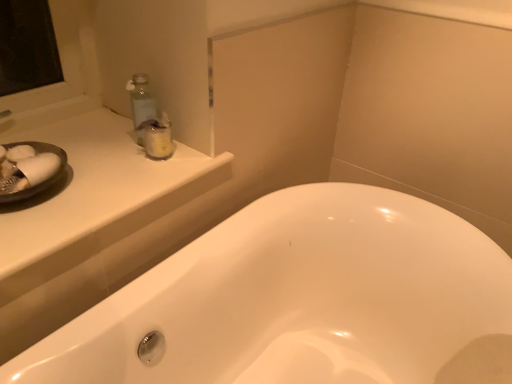
The image size is (512, 384). Describe the element at coordinates (157, 137) in the screenshot. I see `clear plastic jar at upper left` at that location.

This screenshot has width=512, height=384. What do you see at coordinates (303, 301) in the screenshot?
I see `white glossy bathtub at center` at bounding box center [303, 301].

In order to click on white glossy counter top at upper left in this screenshot , I will do pyautogui.click(x=98, y=193).

How different are the orientations of clear plastic jar at upper left and white glossy counter top at upper left in degrees?

6.77 degrees.

Which object is thinner, clear plastic jar at upper left or white glossy counter top at upper left?

Thinner between the two is clear plastic jar at upper left.

From the image's perspective, between clear plastic jar at upper left and white glossy counter top at upper left, which one is located above?

clear plastic jar at upper left, from the image's perspective.

Can you confirm if clear plastic jar at upper left is taller than white glossy bathtub at center?

Incorrect, the height of clear plastic jar at upper left is not larger of that of white glossy bathtub at center.

Is clear plastic jar at upper left smaller than white glossy bathtub at center?

Correct, clear plastic jar at upper left occupies less space than white glossy bathtub at center.

Consider the image. Is clear plastic jar at upper left next to white glossy bathtub at center and touching it?

They are not placed beside each other.

Does white glossy counter top at upper left lie behind white glossy bathtub at center?

Yes, the depth of white glossy counter top at upper left is greater than that of white glossy bathtub at center.

The width and height of the screenshot is (512, 384). I want to click on bathtub beneath the white glossy counter top at upper left (from a real-world perspective), so click(x=303, y=301).

Is white glossy counter top at upper left bigger or smaller than white glossy bathtub at center?

In the image, white glossy counter top at upper left appears to be smaller than white glossy bathtub at center.

Is white glossy counter top at upper left not within clear plastic jar at upper left?

That's correct, white glossy counter top at upper left is outside of clear plastic jar at upper left.

Is there a large distance between white glossy counter top at upper left and clear plastic jar at upper left?

Actually, white glossy counter top at upper left and clear plastic jar at upper left are a little close together.

Is white glossy counter top at upper left bigger than clear plastic jar at upper left?

Yes, white glossy counter top at upper left is bigger than clear plastic jar at upper left.

How many degrees apart are the facing directions of white glossy counter top at upper left and clear plastic jar at upper left?

The angular difference between white glossy counter top at upper left and clear plastic jar at upper left is 6.77 degrees.

Is white glossy bathtub at center in front of clear plastic jar at upper left?

Yes, it is in front of clear plastic jar at upper left.

From a real-world perspective, which is physically below, white glossy bathtub at center or clear plastic jar at upper left?

white glossy bathtub at center is physically lower.

Find the location of a particular element. bathtub below the clear plastic jar at upper left (from a real-world perspective) is located at coordinates (303, 301).

Consider the image. Considering the relative sizes of white glossy bathtub at center and clear plastic jar at upper left in the image provided, is white glossy bathtub at center taller than clear plastic jar at upper left?

Indeed, white glossy bathtub at center has a greater height compared to clear plastic jar at upper left.

Is point (312, 302) positioned in front of point (166, 166)?

No, (312, 302) is behind (166, 166).

From the image's perspective, which one is positioned lower, white glossy bathtub at center or white glossy counter top at upper left?

white glossy bathtub at center is shown below in the image.

Is white glossy bathtub at center outside of white glossy counter top at upper left?

Yes, white glossy bathtub at center is outside of white glossy counter top at upper left.

What's the angular difference between white glossy bathtub at center and white glossy counter top at upper left's facing directions?

The angle between the facing direction of white glossy bathtub at center and the facing direction of white glossy counter top at upper left is 0.788 degrees.

Locate an element on the screen. The height and width of the screenshot is (384, 512). counter top lying on the left of clear plastic jar at upper left is located at coordinates (98, 193).

What are the coordinates of `toiletry behind the white glossy bathtub at center` in the screenshot? It's located at (157, 137).

Estimate the real-world distances between objects in this image. Which object is closer to clear plastic jar at upper left, white glossy bathtub at center or white glossy counter top at upper left?

Among the two, white glossy counter top at upper left is located nearer to clear plastic jar at upper left.

Which object lies further to the anchor point white glossy counter top at upper left, clear plastic jar at upper left or white glossy bathtub at center?

white glossy bathtub at center.

From the image, which object appears to be farther from white glossy bathtub at center, clear plastic jar at upper left or white glossy counter top at upper left?

Based on the image, clear plastic jar at upper left appears to be further to white glossy bathtub at center.

When comparing their distances from white glossy bathtub at center, does white glossy counter top at upper left or clear plastic jar at upper left seem closer?

The object closer to white glossy bathtub at center is white glossy counter top at upper left.

Based on their spatial positions, is white glossy bathtub at center or clear plastic jar at upper left further from white glossy counter top at upper left?

The object further to white glossy counter top at upper left is white glossy bathtub at center.

Considering their positions, is white glossy counter top at upper left positioned closer to clear plastic jar at upper left than white glossy bathtub at center?

white glossy counter top at upper left is closer to clear plastic jar at upper left.

The image size is (512, 384). I want to click on counter top between clear plastic jar at upper left and white glossy bathtub at center from top to bottom, so click(x=98, y=193).